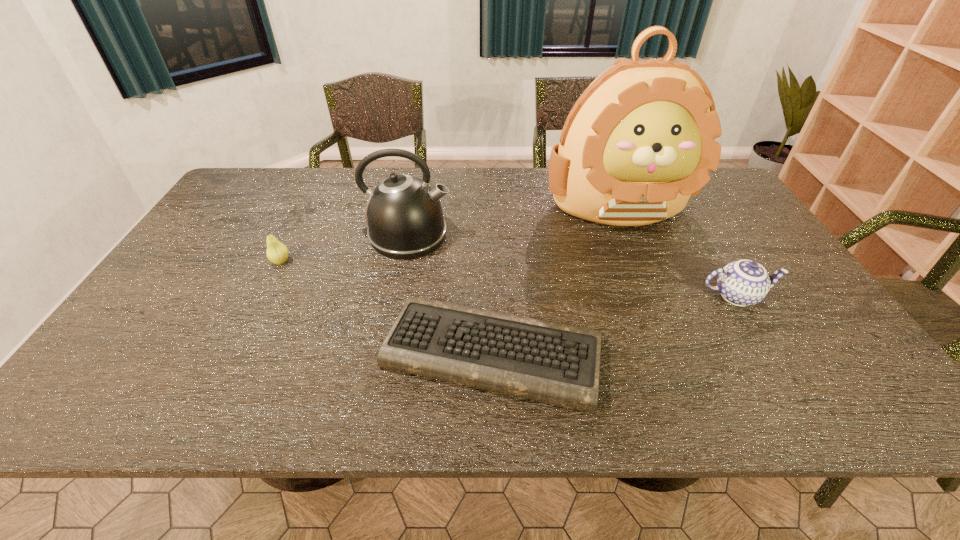
Image resolution: width=960 pixels, height=540 pixels. I want to click on backpack, so click(x=640, y=140).

The height and width of the screenshot is (540, 960). Find the location of `the second tallest object`. the second tallest object is located at coordinates (404, 215).

Where is `pear`? The height and width of the screenshot is (540, 960). pear is located at coordinates (277, 253).

This screenshot has width=960, height=540. I want to click on chinaware, so click(742, 283).

This screenshot has height=540, width=960. I want to click on computer keyboard, so click(559, 364).

The image size is (960, 540). I want to click on vacant space situated 0.200m on the front-facing side of the tallest object, so click(652, 289).

Where is `vacant region located 0.310m on the spout of the kettle`? The image size is (960, 540). vacant region located 0.310m on the spout of the kettle is located at coordinates (556, 235).

At what (x,y) coordinates should I click in order to perform the action: click on vacant area situated on the right of the leftmost object. Please return your answer as a coordinate pair (x, y). The height and width of the screenshot is (540, 960). Looking at the image, I should click on (346, 262).

Locate an element on the screen. The width and height of the screenshot is (960, 540). free location located 0.090m at the spout of the chinaware is located at coordinates (809, 296).

Locate an element on the screen. The image size is (960, 540). vacant space located on the right of the shortest object is located at coordinates (692, 352).